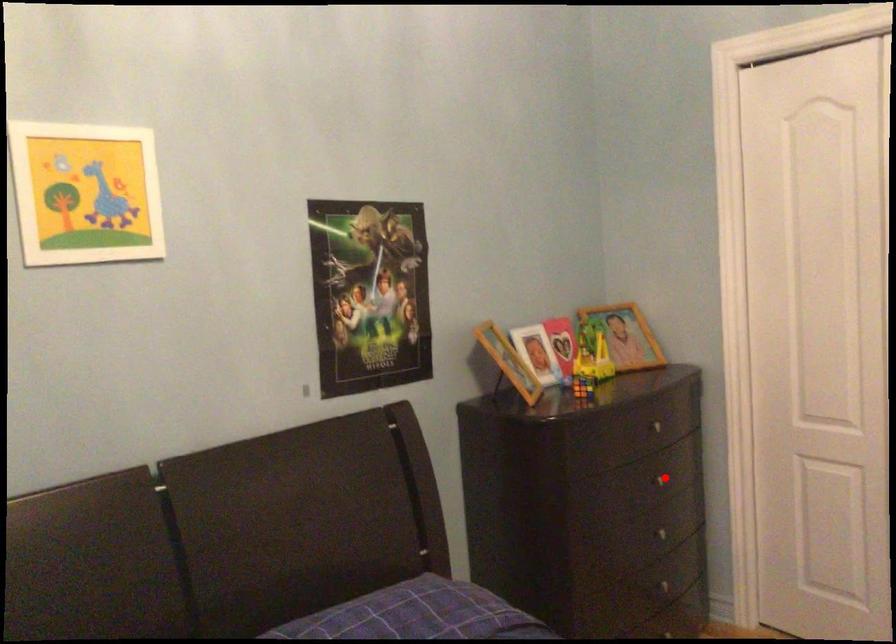
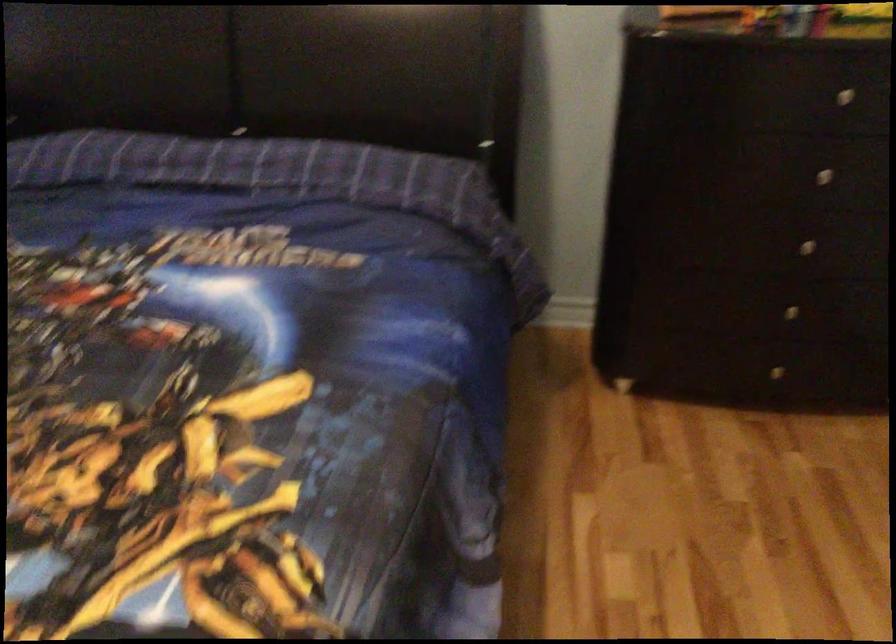
The point at the highlighted location is marked in the first image. Where is the corresponding point in the second image?

(833, 169)